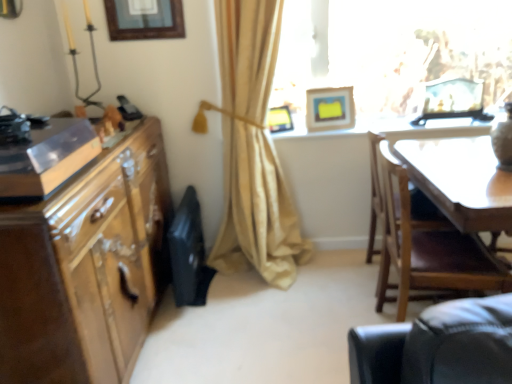
Question: Relative to wooden chair at right, is wooden picture frame at upper center, acting as the fourth picture frame starting from the right, in front or behind?

Choices:
 (A) behind
 (B) front

Answer: (A)

Question: From the image's perspective, relative to wooden chair at right, is wooden picture frame at upper center, acting as the fourth picture frame starting from the right, above or below?

Choices:
 (A) below
 (B) above

Answer: (B)

Question: Estimate the real-world distances between objects in this image. Which object is farther from the white glossy table at upper center?

Choices:
 (A) shiny brown cabinet at left
 (B) beige fabric curtain at center
 (C) matte yellow picture frame at upper right, positioned as the 3th picture frame in left-to-right order
 (D) translucent glass frame at upper right
 (E) wooden picture frame at upper center, acting as the fourth picture frame starting from the right

Answer: (A)

Question: Which object is positioned closest to the matte yellow picture frame at upper center, the 2th picture frame when ordered from left to right?

Choices:
 (A) matte yellow picture frame at upper right, which is the 2th picture frame in right-to-left order
 (B) white glossy table at upper center
 (C) shiny brown cabinet at left
 (D) wooden picture frame at upper right, positioned as the fourth picture frame in left-to-right order
 (E) translucent glass frame at upper right

Answer: (A)